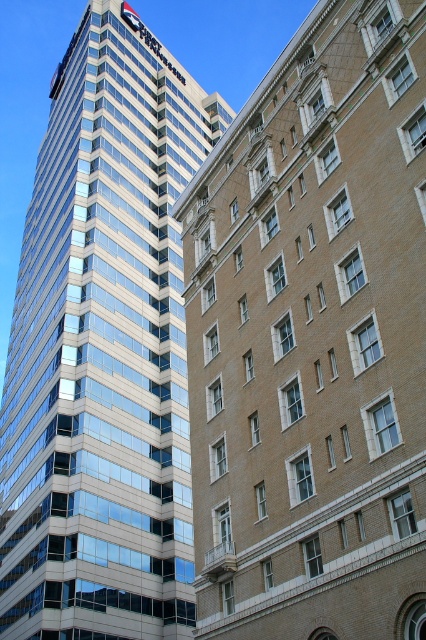
You are a drone operator tasked with flying a drone from the beige brick building at center to the glassy reflective skyscraper at center. Based on their positions, which building should you start your flight from, and why?

You should start your flight from the beige brick building at center because it is in front of the glassy reflective skyscraper at center, meaning the skyscraper is behind it. Starting from the closer building ensures a more direct and safer flight path.

You are an architect analyzing the layout of the two buildings in the image. Given that the beige brick building at center is located at coordinates 0.530, 0.735, can you determine its position relative to the modern skyscraper on the left?

The beige brick building at center is positioned to the right of the modern skyscraper on the left since its coordinates are at [313,339], which places it further along the horizontal axis compared to the skyscraper.